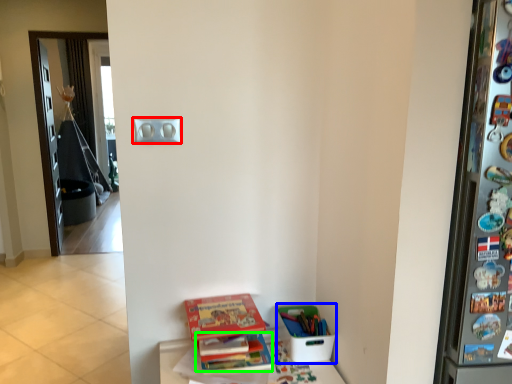
Question: Which object is the farthest from light switch (highlighted by a red box)? Choose among these: box (highlighted by a blue box) or book (highlighted by a green box).

Choices:
 (A) box
 (B) book

Answer: (A)